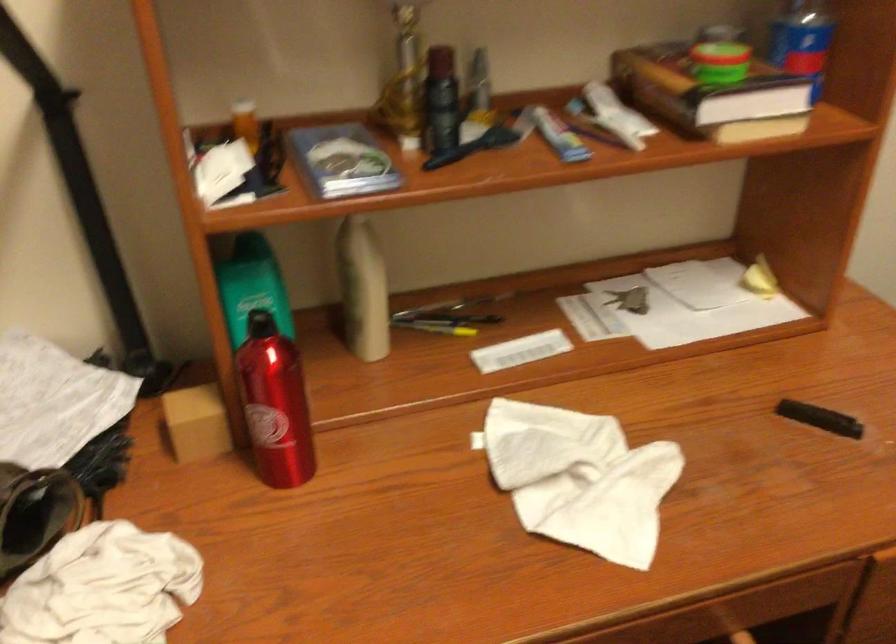
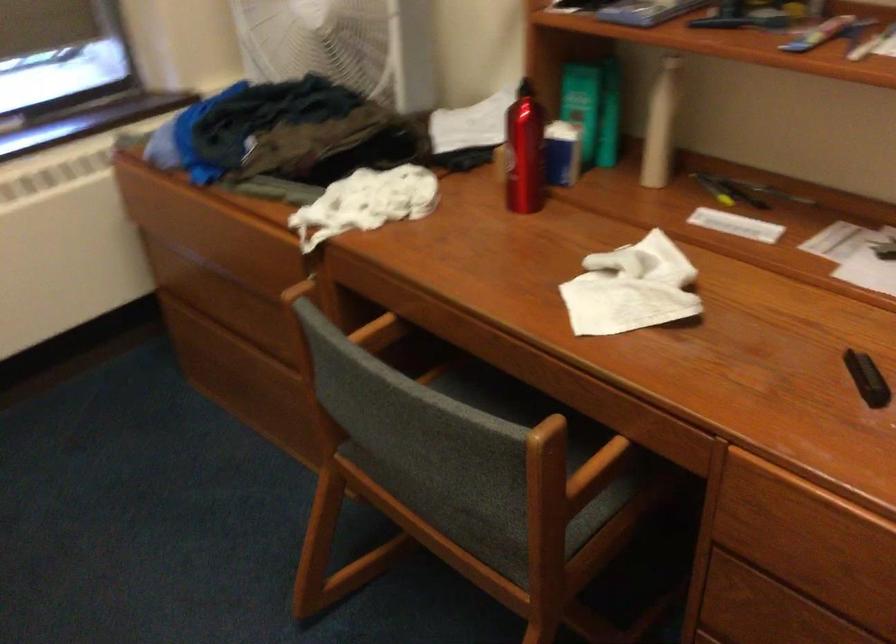
Where in the second image is the point corresponding to the point at 291,412 from the first image?

(524, 152)